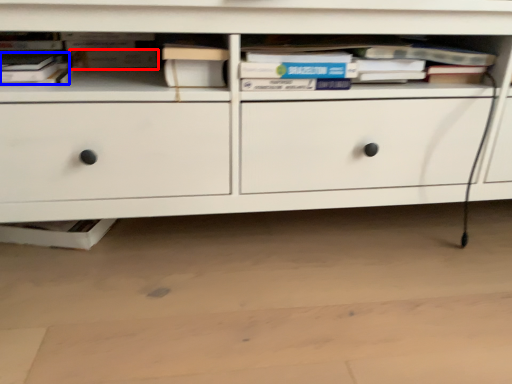
Question: Which object appears closest to the camera in this image, paperback book (highlighted by a red box) or book (highlighted by a blue box)?

Choices:
 (A) paperback book
 (B) book

Answer: (B)